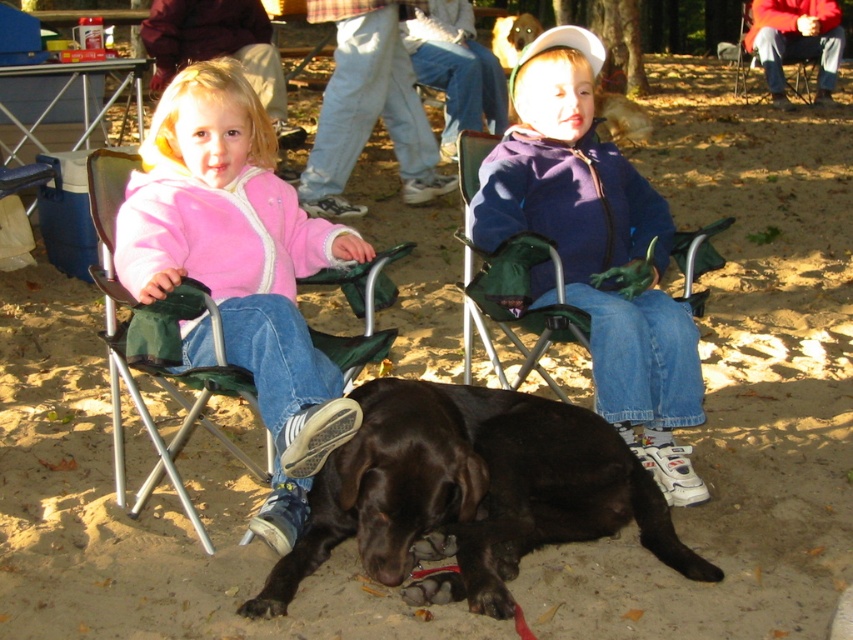
Which is behind, point (498, 480) or point (697, 362)?

Point (697, 362)

Does shiny black dog at center appear under purple fleece jacket at center?

Yes, shiny black dog at center is below purple fleece jacket at center.

Is point (368, 452) behind point (679, 348)?

No.

The image size is (853, 640). Find the location of `shiny black dog at center`. shiny black dog at center is located at coordinates pyautogui.click(x=471, y=493).

Based on the photo, how distant is shiny black dog at center from pink fleece jacket at left?

They are 16.41 inches apart.

The width and height of the screenshot is (853, 640). Describe the element at coordinates (471, 493) in the screenshot. I see `shiny black dog at center` at that location.

Find the location of `shiny black dog at center`. shiny black dog at center is located at coordinates (471, 493).

Can you confirm if pink fleece jacket at left is positioned to the left of purple fleece jacket at center?

Yes, pink fleece jacket at left is to the left of purple fleece jacket at center.

Is point (322, 424) closer to viewer compared to point (560, 232)?

That is True.

Does point (193, 348) come farther from viewer compared to point (683, 384)?

No.

What are the coordinates of `pink fleece jacket at left` in the screenshot? It's located at (241, 266).